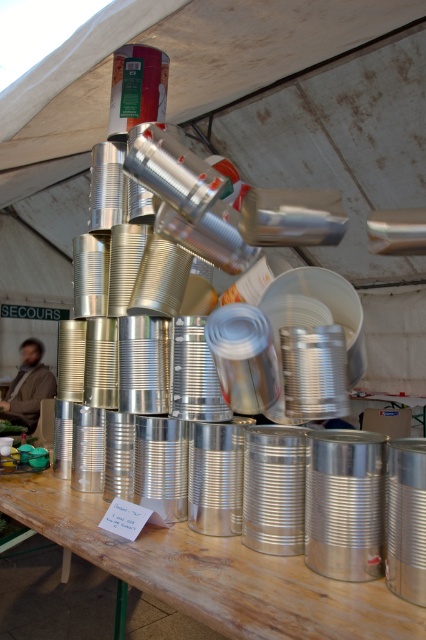
Question: Is wooden table at center thinner than brown fuzzy jacket at lower left?

Choices:
 (A) yes
 (B) no

Answer: (B)

Question: Is wooden table at center wider than brown fuzzy jacket at lower left?

Choices:
 (A) no
 (B) yes

Answer: (B)

Question: Is wooden table at center to the left of brown fuzzy jacket at lower left from the viewer's perspective?

Choices:
 (A) no
 (B) yes

Answer: (A)

Question: Which point appears closest to the camera in this image?

Choices:
 (A) (167, 576)
 (B) (34, 356)

Answer: (A)